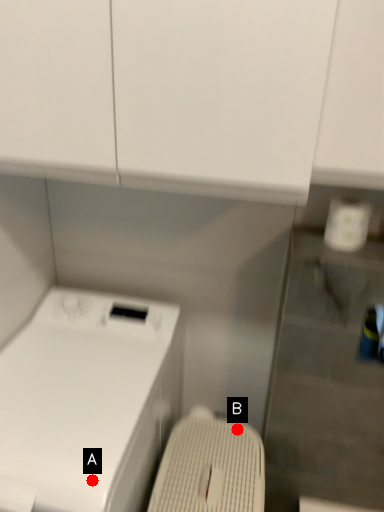
Question: Two points are circled on the image, labeled by A and B beside each circle. Which point is further to the camera?

Choices:
 (A) A is further
 (B) B is further

Answer: (B)